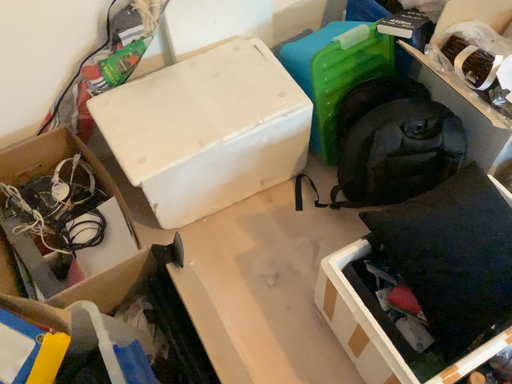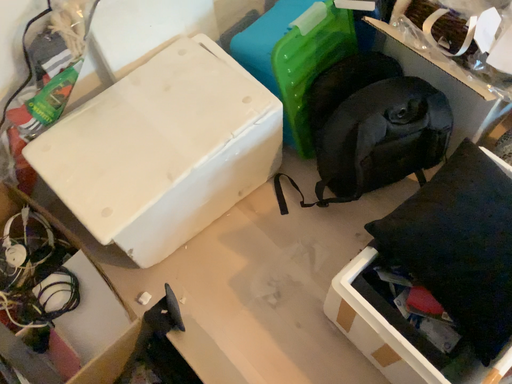
Question: Which way did the camera rotate in the video?

Choices:
 (A) rotated right
 (B) rotated left

Answer: (A)